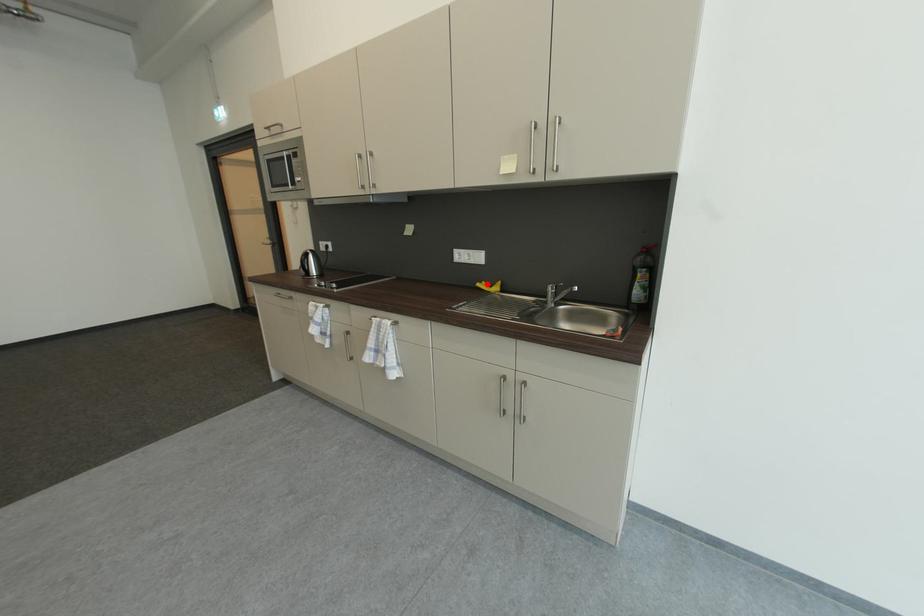
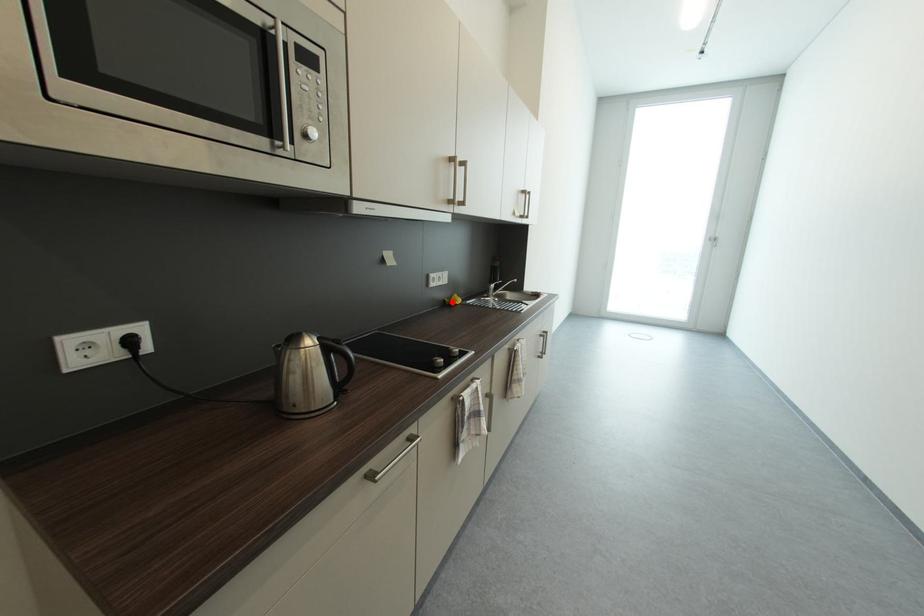
I am providing you with two images of the same scene from different viewpoints. A red point is marked on the first image and another point is marked on the second image. Is the red point in image1 aligned with the point shown in image2?

Yes